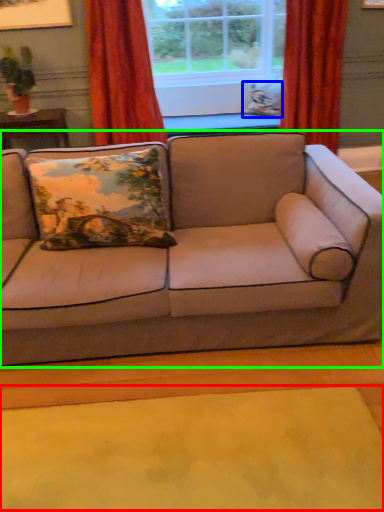
Question: Which object is positioned farthest from mat (highlighted by a red box)? Select from pillow (highlighted by a blue box) and studio couch (highlighted by a green box).

Choices:
 (A) pillow
 (B) studio couch

Answer: (A)